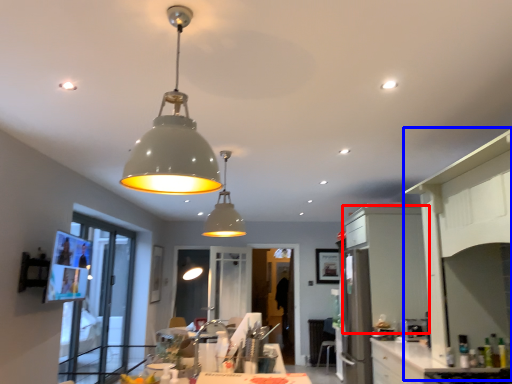
Question: Which object appears closest to the camera in this image, cabinetry (highlighted by a red box) or side (highlighted by a blue box)?

Choices:
 (A) cabinetry
 (B) side

Answer: (B)